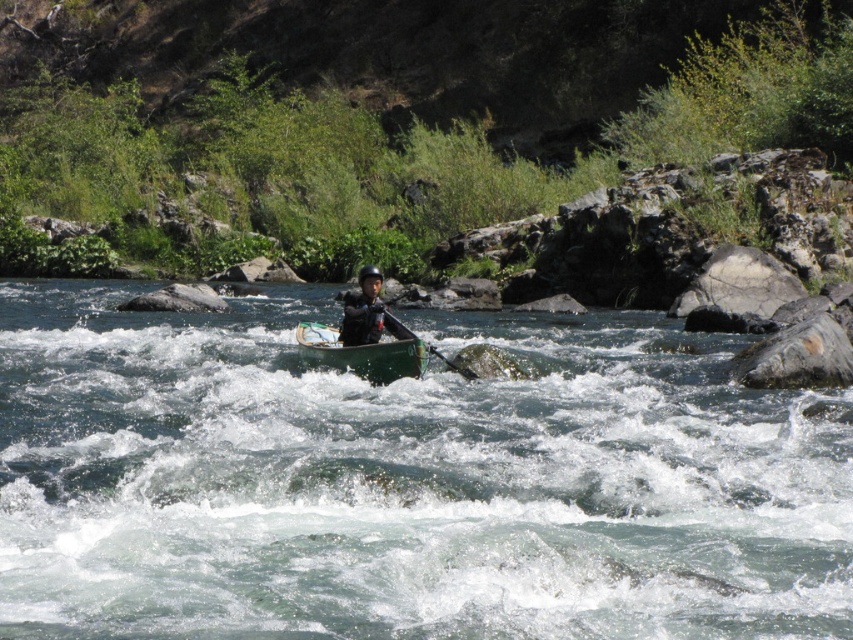
Which of these two, green wood canoe at center or green plastic canoe at center, stands shorter?

green plastic canoe at center

Does green wood canoe at center appear on the left side of green plastic canoe at center?

In fact, green wood canoe at center is to the right of green plastic canoe at center.

Is point (28, 300) behind point (300, 353)?

Yes, point (28, 300) is behind point (300, 353).

Image resolution: width=853 pixels, height=640 pixels. Find the location of `green wood canoe at center`. green wood canoe at center is located at coordinates (404, 481).

Image resolution: width=853 pixels, height=640 pixels. What do you see at coordinates (404, 481) in the screenshot?
I see `green wood canoe at center` at bounding box center [404, 481].

Measure the distance between point (202, 472) and camera.

Point (202, 472) and camera are 40.57 feet apart.

This screenshot has width=853, height=640. Identify the location of green wood canoe at center. (404, 481).

Who is more forward, (305,346) or (375,321)?

Point (375,321) is more forward.

Can you confirm if green plastic canoe at center is bigger than matte black helmet at center?

Incorrect, green plastic canoe at center is not larger than matte black helmet at center.

Who is more distant from viewer, [387,324] or [379,323]?

Point [387,324]

Locate an element on the screen. This screenshot has height=640, width=853. green plastic canoe at center is located at coordinates (363, 353).